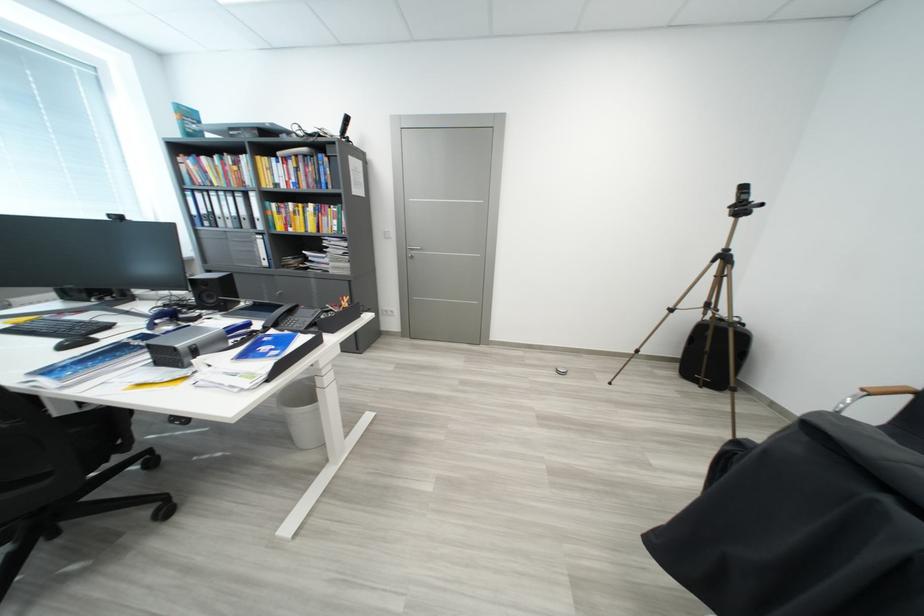
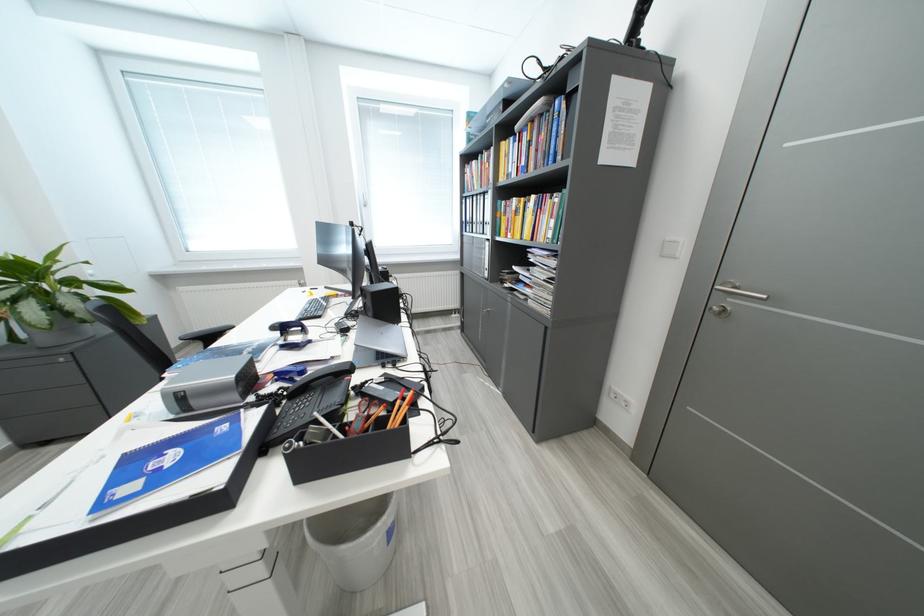
The point at (67, 342) is marked in the first image. Where is the corresponding point in the second image?

(286, 323)